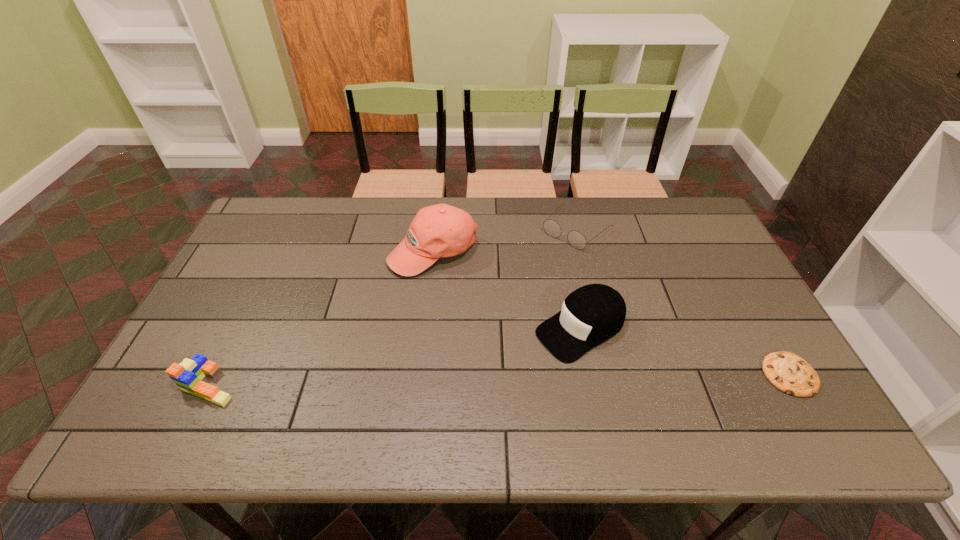
You are a GUI agent. You are given a task and a screenshot of the screen. Output one action in this format:
    pyautogui.click(x=<x>, y=<y>)
    Task: Click on the Lego that is positioned at the near edge
    
    Given the screenshot: What is the action you would take?
    pyautogui.click(x=187, y=375)

Find the location of a particular element. The height and width of the screenshot is (540, 960). cookie at the near edge is located at coordinates click(x=789, y=373).

This screenshot has height=540, width=960. Identify the location of object that is at the left edge. (187, 375).

The width and height of the screenshot is (960, 540). In order to click on object located in the right edge section of the desktop in this screenshot , I will do `click(789, 373)`.

Where is `object located in the near left corner section of the desktop`? object located in the near left corner section of the desktop is located at coordinates tap(187, 375).

Locate an element on the screen. The height and width of the screenshot is (540, 960). object present at the near right corner is located at coordinates (789, 373).

Find the location of a particular element. vacant area at the far edge of the desktop is located at coordinates (375, 214).

Find the location of a particular element. free space at the near edge of the desktop is located at coordinates (492, 381).

Image resolution: width=960 pixels, height=540 pixels. What are the coordinates of `vacant space at the left edge of the desktop` in the screenshot? It's located at (216, 314).

In the image, there is a desktop. Identify the location of blank space at the right edge. (682, 269).